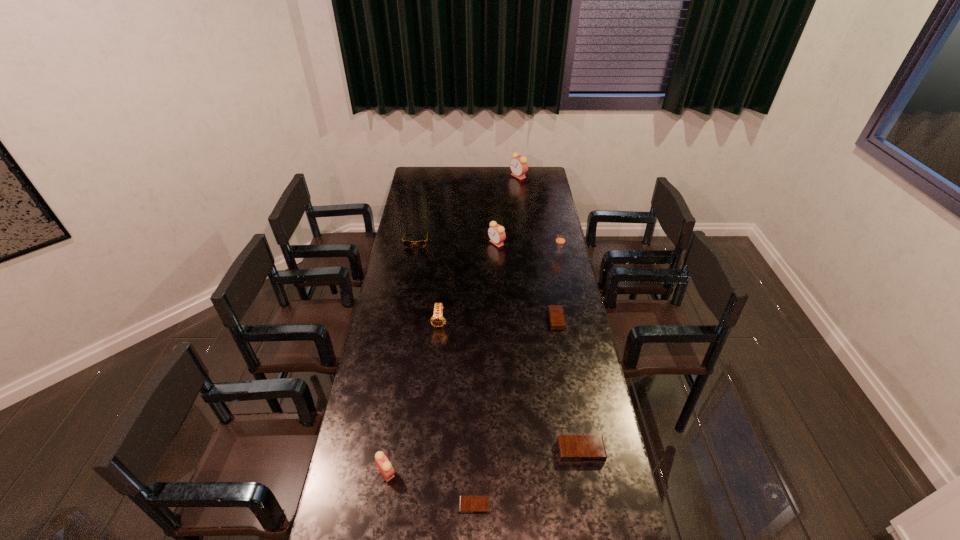
Image resolution: width=960 pixels, height=540 pixels. What are the coordinates of `free region that satisfies the following two spatial constraints: 1. on the back side of the fourth farthest object; 2. on the face of the farthest pink alarm clock` in the screenshot? It's located at (542, 176).